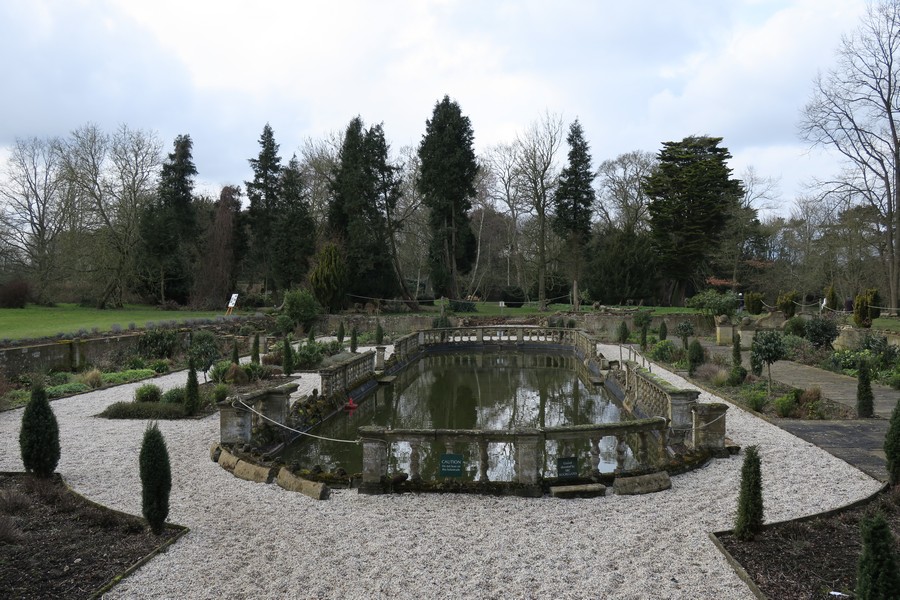
The height and width of the screenshot is (600, 900). Find the location of `small green plants`. small green plants is located at coordinates (148, 471), (39, 434), (744, 489).